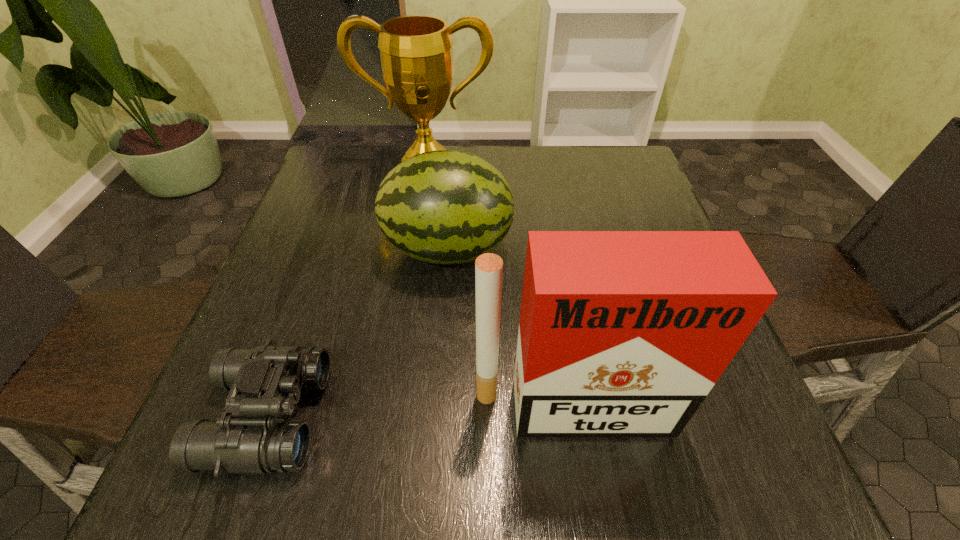
I want to click on vacant space that satisfies the following two spatial constraints: 1. on the front-facing side of the cigarette case; 2. through the lenses of the binoculars, so click(573, 416).

This screenshot has height=540, width=960. Find the location of `vacant space that satisfies the following two spatial constraints: 1. on the front-facing side of the award; 2. through the lenses of the binoculars`. vacant space that satisfies the following two spatial constraints: 1. on the front-facing side of the award; 2. through the lenses of the binoculars is located at coordinates (388, 416).